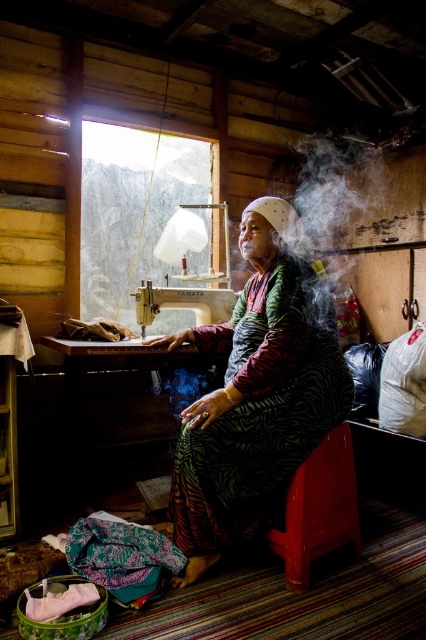
Between green zebra-patterned dress at center and shiny plastic stool at lower center, which one has less height?

With less height is shiny plastic stool at lower center.

Measure the distance between green zebra-patterned dress at center and camera.

green zebra-patterned dress at center is 5.97 feet away from camera.

This screenshot has width=426, height=640. Describe the element at coordinates (256, 396) in the screenshot. I see `green zebra-patterned dress at center` at that location.

What are the coordinates of `green zebra-patterned dress at center` in the screenshot? It's located at (256, 396).

Who is positioned more to the right, green zebra-patterned dress at center or white smoke at upper center?

white smoke at upper center is more to the right.

Is green zebra-patterned dress at center to the right of white smoke at upper center from the viewer's perspective?

In fact, green zebra-patterned dress at center is to the left of white smoke at upper center.

Identify the location of green zebra-patterned dress at center. The width and height of the screenshot is (426, 640). (256, 396).

Consider the image. Is white smoke at upper center to the right of metallic sewing machine at left from the viewer's perspective?

Yes, white smoke at upper center is to the right of metallic sewing machine at left.

Based on the photo, is white smoke at upper center shorter than metallic sewing machine at left?

No, white smoke at upper center is not shorter than metallic sewing machine at left.

Is point (301, 221) positioned in front of point (227, 284)?

Yes.

Image resolution: width=426 pixels, height=640 pixels. Identify the location of white smoke at upper center. (328, 188).